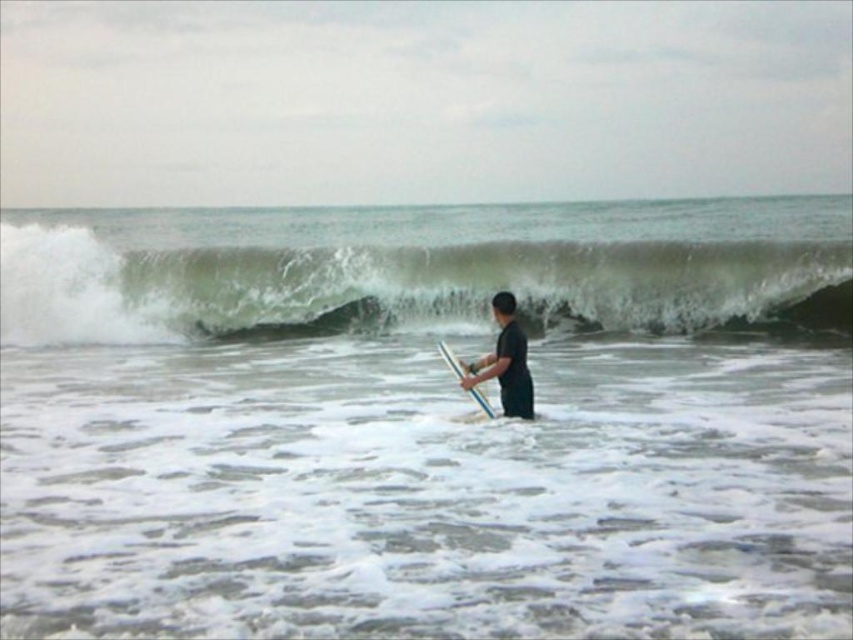
You are a photographer trying to capture the white frothy water at center and the white frothy wave at upper center. Which one is wider?

The white frothy wave at upper center is wider than the white frothy water at center.

You are a photographer planning to capture the white frothy wave at upper center and the dark gray matte surfboard at center. Based on their sizes, which object should you focus on to ensure it fits entirely within your camera frame?

The white frothy wave at upper center is wider than the dark gray matte surfboard at center, so focusing on the wave will ensure it fits within the camera frame as it is wider.